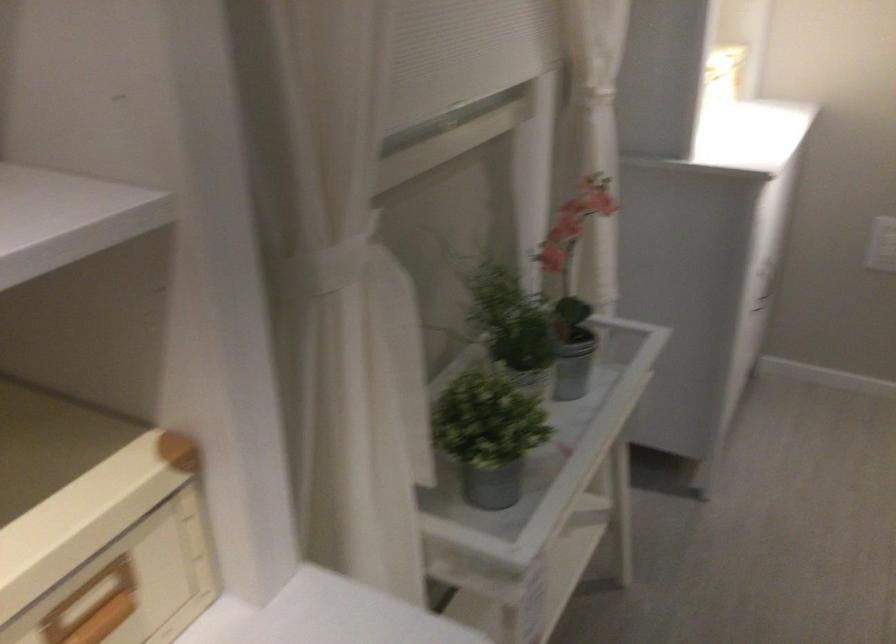
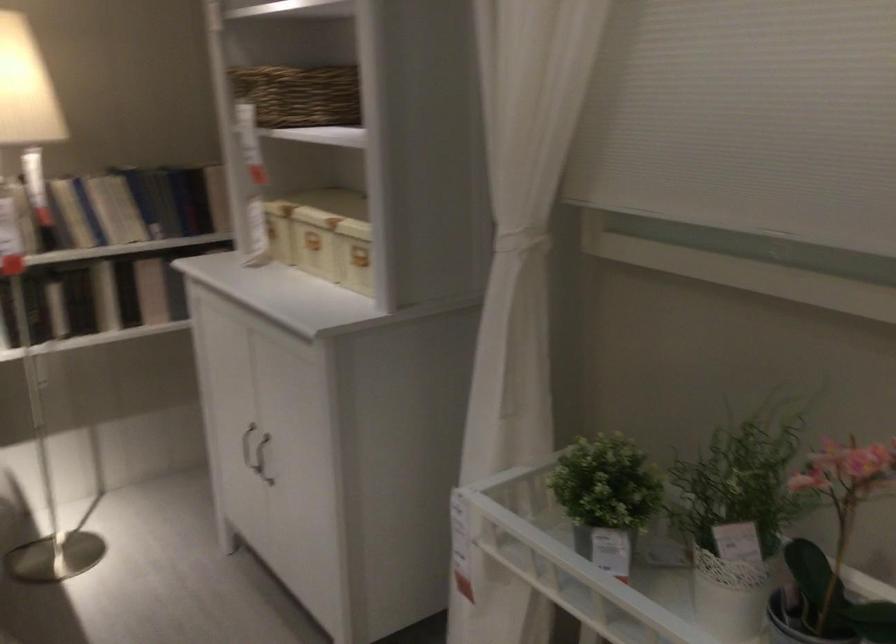
The point at [509,413] is marked in the first image. Where is the corresponding point in the second image?

(606, 498)